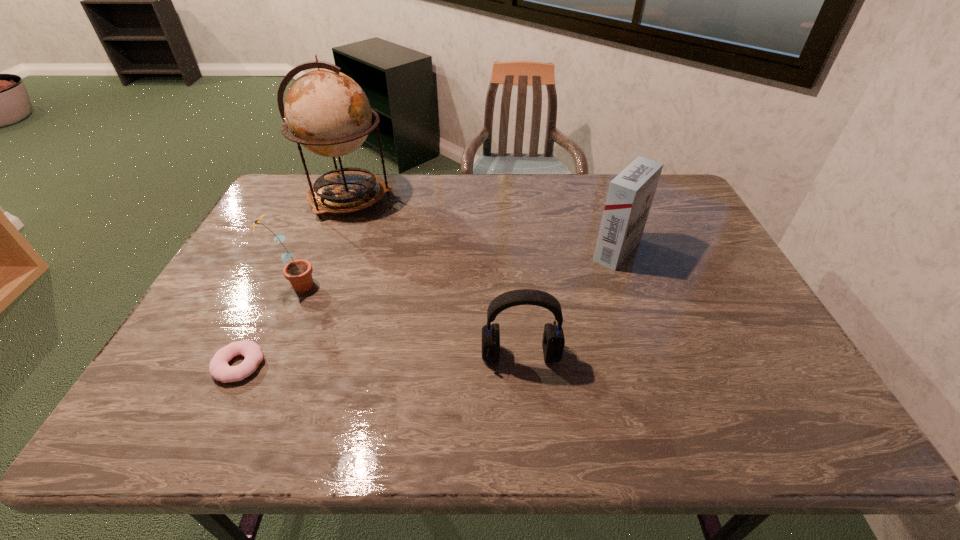
At what (x,y) coordinates should I click in order to perform the action: click on unoccupied area between the sunflower and the second object from right to left. Please return your answer as a coordinate pair (x, y). Looking at the image, I should click on (408, 320).

Where is `vacant space in between the tallest object and the third nearest object`? Image resolution: width=960 pixels, height=540 pixels. vacant space in between the tallest object and the third nearest object is located at coordinates (323, 242).

This screenshot has width=960, height=540. In order to click on unoccupied area between the globe and the rightmost object in this screenshot , I will do `click(484, 225)`.

Identify which object is located as the fourth nearest to the third nearest object. Please provide its 2D coordinates. Your answer should be formatted as a tuple, i.e. [(x, y)], where the tuple contains the x and y coordinates of a point satisfying the conditions above.

[(630, 195)]

Identify which object is the fourth nearest to the doughnut. Please provide its 2D coordinates. Your answer should be formatted as a tuple, i.e. [(x, y)], where the tuple contains the x and y coordinates of a point satisfying the conditions above.

[(630, 195)]

Image resolution: width=960 pixels, height=540 pixels. Find the location of `vacant space that satisfies the following two spatial constraints: 1. at the center of the second farthest object; 2. on the left side of the tallest object`. vacant space that satisfies the following two spatial constraints: 1. at the center of the second farthest object; 2. on the left side of the tallest object is located at coordinates (329, 251).

Where is `free spot that satisfies the following two spatial constraints: 1. at the center of the rightmost object; 2. on the left side of the farthest object`? The image size is (960, 540). free spot that satisfies the following two spatial constraints: 1. at the center of the rightmost object; 2. on the left side of the farthest object is located at coordinates (329, 251).

The width and height of the screenshot is (960, 540). I want to click on blank space that satisfies the following two spatial constraints: 1. at the center of the second farthest object; 2. on the left side of the globe, so click(329, 251).